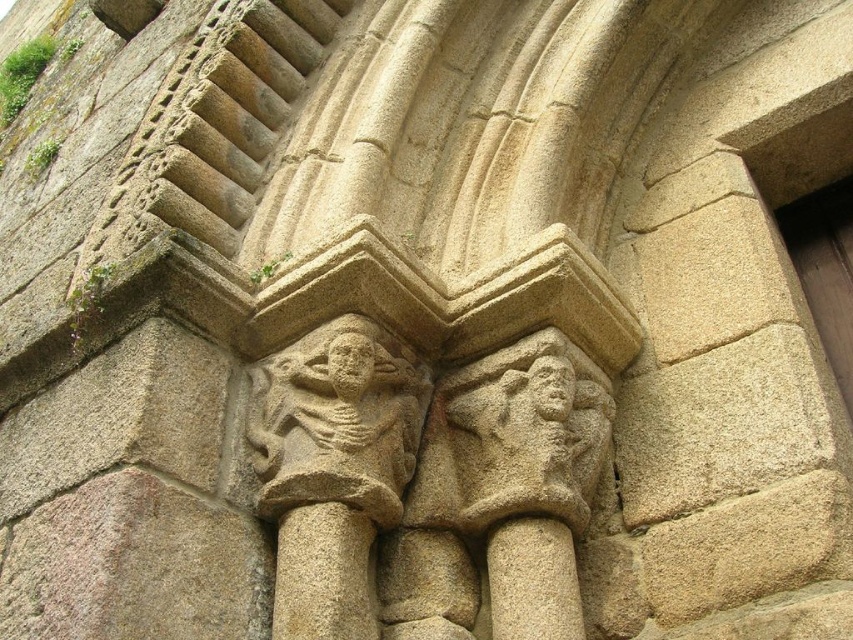
Question: Can you confirm if gray stone pillar at center is bigger than smooth stone pillar at center?

Choices:
 (A) no
 (B) yes

Answer: (B)

Question: Considering the real-world distances, which object is farthest from the smooth stone face at center?

Choices:
 (A) carved stone figure at center
 (B) smooth stone pillar at center

Answer: (A)

Question: Is light beige stone face at center closer to the viewer compared to smooth stone face at center?

Choices:
 (A) yes
 (B) no

Answer: (A)

Question: Is light beige stone face at center smaller than smooth stone face at center?

Choices:
 (A) yes
 (B) no

Answer: (A)

Question: Among these points, which one is nearest to the camera?

Choices:
 (A) (566, 548)
 (B) (543, 378)
 (C) (332, 376)
 (D) (279, 540)

Answer: (D)

Question: Which point is closer to the camera taking this photo?

Choices:
 (A) (534, 392)
 (B) (364, 333)
 (C) (271, 426)
 (D) (357, 592)

Answer: (D)